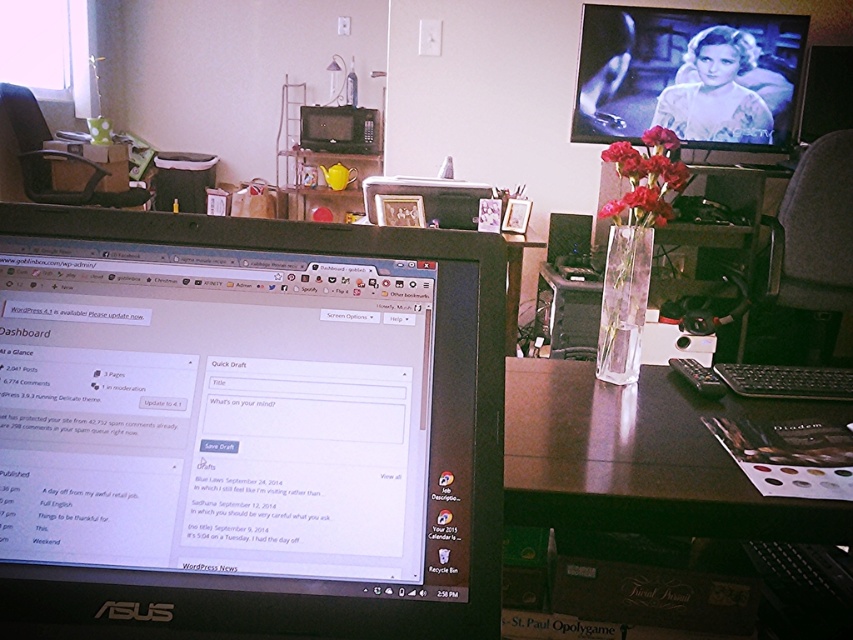
You are organizing a desk and need to place a new keyboard between the black glossy table at center and the matte black monitor at upper right. Based on their positions, where should you place the keyboard?

Since the black glossy table at center is to the left of the matte black monitor at upper right, you should place the keyboard between them, positioning it to the right of the black glossy table at center and to the left of the matte black monitor at upper right.

Based on the photo, you are organizing your desk and need to know the height of the objects. Which object is taller, the matte black monitor at upper right or the matte glass vase at center?

The matte black monitor at upper right is taller than the matte glass vase at center according to the description.

In the scene shown: You are organizing a workspace and need to place a new keyboard between the black glossy table at center and the matte glass vase at center. Given that the keyboard is 15 inches wide, will it fit in the space between them?

The space between the black glossy table at center and the matte glass vase at center is 16.23 inches, so the keyboard at 15 inches wide will fit comfortably between them with some extra space remaining.